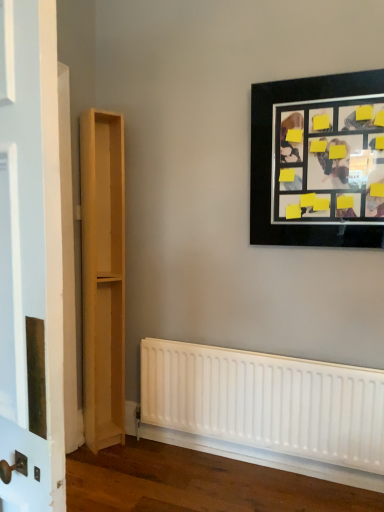
Question: Does point (382, 225) appear closer or farther from the camera than point (89, 269)?

Choices:
 (A) closer
 (B) farther

Answer: (A)

Question: Looking at their shapes, would you say black matte picture frame at upper right is wider or thinner than light wood bookshelf at left?

Choices:
 (A) thin
 (B) wide

Answer: (A)

Question: Based on their relative distances, which object is farther from the light wood bookshelf at left?

Choices:
 (A) white matte radiator at lower center
 (B) black matte picture frame at upper right

Answer: (B)

Question: Based on their relative distances, which object is farther from the white matte radiator at lower center?

Choices:
 (A) black matte picture frame at upper right
 (B) light wood bookshelf at left

Answer: (A)